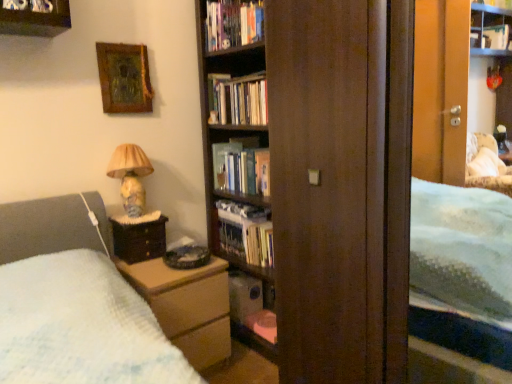
Question: From the image's perspective, is matte ceramic lamp at left beneath hardcover book at upper center, acting as the 1th book starting from the top?

Choices:
 (A) yes
 (B) no

Answer: (A)

Question: Is matte ceramic lamp at left further to camera compared to hardcover book at upper center, the 5th book positioned from the bottom?

Choices:
 (A) yes
 (B) no

Answer: (B)

Question: Considering the relative sizes of matte ceramic lamp at left and hardcover book at upper center, the 5th book positioned from the bottom, in the image provided, is matte ceramic lamp at left thinner than hardcover book at upper center, the 5th book positioned from the bottom,?

Choices:
 (A) yes
 (B) no

Answer: (B)

Question: Considering the relative sizes of matte ceramic lamp at left and hardcover book at upper center, the 5th book positioned from the bottom, in the image provided, is matte ceramic lamp at left bigger than hardcover book at upper center, the 5th book positioned from the bottom,?

Choices:
 (A) yes
 (B) no

Answer: (A)

Question: Can you confirm if matte ceramic lamp at left is wider than hardcover book at upper center, the 5th book positioned from the bottom?

Choices:
 (A) yes
 (B) no

Answer: (A)

Question: From a real-world perspective, is matte ceramic lamp at left physically above hardcover book at upper center, acting as the 1th book starting from the top?

Choices:
 (A) no
 (B) yes

Answer: (A)

Question: Is hardcover book at center facing away from hardcover book at center, which is counted as the third book, starting from the bottom?

Choices:
 (A) no
 (B) yes

Answer: (A)

Question: Does hardcover book at center have a greater width compared to hardcover book at center, which is counted as the third book, starting from the bottom?

Choices:
 (A) yes
 (B) no

Answer: (A)

Question: Is hardcover book at center not near hardcover book at center, arranged as the 3th book when viewed from the top?

Choices:
 (A) no
 (B) yes

Answer: (A)

Question: Considering the relative sizes of hardcover book at center and hardcover book at center, arranged as the 3th book when viewed from the top, in the image provided, is hardcover book at center thinner than hardcover book at center, arranged as the 3th book when viewed from the top,?

Choices:
 (A) yes
 (B) no

Answer: (B)

Question: Considering the relative sizes of hardcover book at center and hardcover book at center, which is counted as the third book, starting from the bottom, in the image provided, is hardcover book at center shorter than hardcover book at center, which is counted as the third book, starting from the bottom,?

Choices:
 (A) no
 (B) yes

Answer: (A)

Question: Is hardcover book at center smaller than hardcover book at center, arranged as the 3th book when viewed from the top?

Choices:
 (A) no
 (B) yes

Answer: (B)

Question: Is hardcover book at center, which appears as the 4th book when ordered from the bottom, completely or partially outside of hardcover book at upper center, the 5th book positioned from the bottom?

Choices:
 (A) yes
 (B) no

Answer: (A)